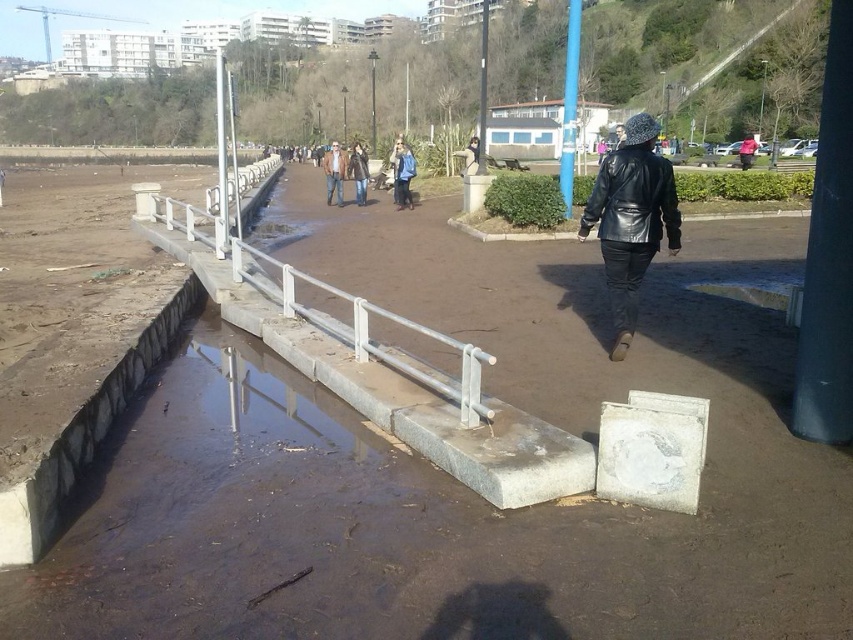
Who is taller, denim jacket at center or leather jacket at center?

With more height is denim jacket at center.

Locate an element on the screen. denim jacket at center is located at coordinates (334, 172).

Locate an element on the screen. The image size is (853, 640). denim jacket at center is located at coordinates (334, 172).

I want to click on denim jacket at center, so click(334, 172).

Which of these two, blue denim jacket at center or matte pink shirt at center, stands shorter?

blue denim jacket at center

Does blue denim jacket at center appear on the right side of matte pink shirt at center?

Incorrect, blue denim jacket at center is not on the right side of matte pink shirt at center.

Where is `blue denim jacket at center`? This screenshot has width=853, height=640. blue denim jacket at center is located at coordinates (403, 173).

I want to click on blue denim jacket at center, so click(x=403, y=173).

Is matte black jacket at center positioned behind matte pink shirt at center?

No, matte black jacket at center is closer to the viewer.

Between matte black jacket at center and matte pink shirt at center, which one is positioned higher?

matte pink shirt at center is above.

Does point (479, 145) lie in front of point (753, 150)?

Yes, point (479, 145) is closer to viewer.

I want to click on matte black jacket at center, so click(x=471, y=156).